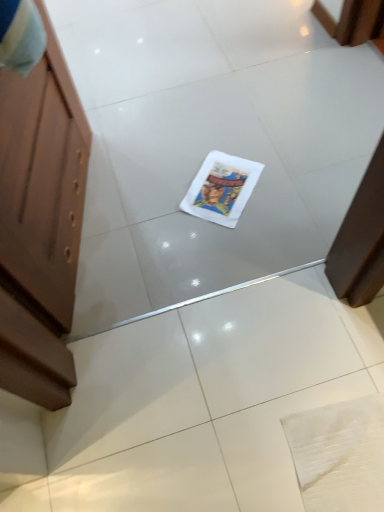
This screenshot has width=384, height=512. I want to click on white paper comic book at center, so click(221, 188).

Describe the element at coordinates (221, 188) in the screenshot. I see `white paper comic book at center` at that location.

What is the approximate width of white paper comic book at center?

white paper comic book at center is 11.59 inches in width.

The image size is (384, 512). What are the coordinates of `white paper comic book at center` in the screenshot? It's located at (221, 188).